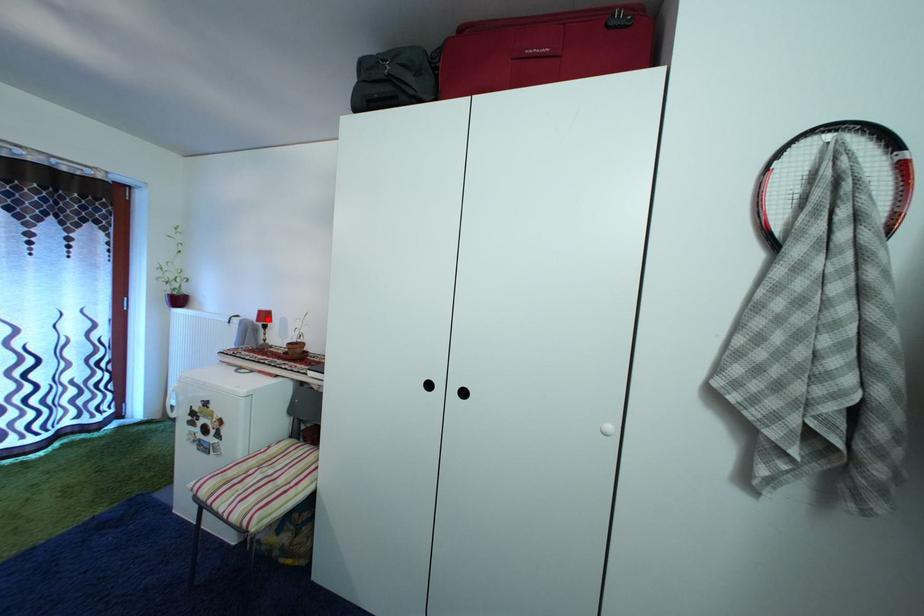
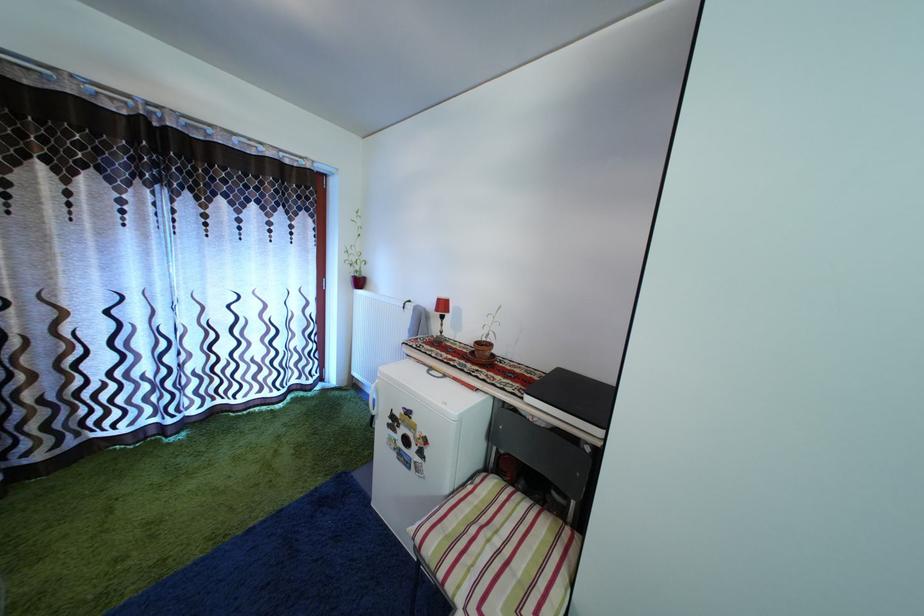
Question: I am providing you with two images of the same scene from different viewpoints. A red point is marked on the first image. Is the red point's position out of view in image 2?

Choices:
 (A) Yes
 (B) No

Answer: (B)